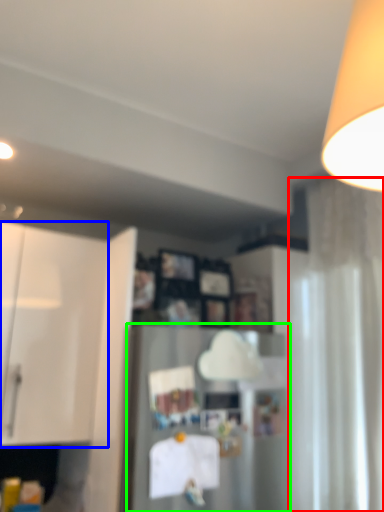
Question: Estimate the real-world distances between objects in this image. Which object is farther from curtain (highlighted by a red box), cabinetry (highlighted by a blue box) or appliance (highlighted by a green box)?

Choices:
 (A) cabinetry
 (B) appliance

Answer: (A)